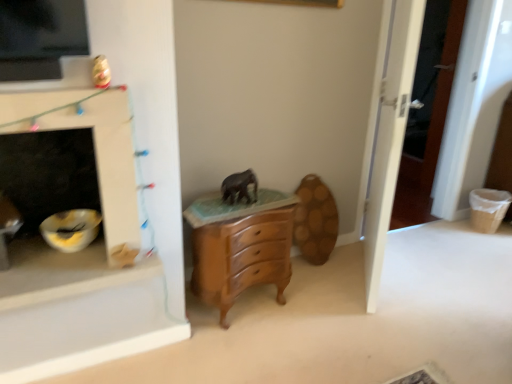
Measure the distance between white glossy fireplace at left and camera.

white glossy fireplace at left is 1.37 meters from camera.

Locate an element on the screen. wooden chest of drawers at center is located at coordinates (241, 247).

Considering the relative positions of white glossy fireplace at left and matte gray elephant at center in the image provided, is white glossy fireplace at left in front of matte gray elephant at center?

That is True.

Would you consider white glossy fireplace at left to be distant from matte gray elephant at center?

No.

Is white glossy fireplace at left not inside matte gray elephant at center?

white glossy fireplace at left lies outside matte gray elephant at center's area.

Is point (46, 130) farther from viewer compared to point (226, 288)?

No, it is in front of (226, 288).

Is white glossy fireplace at left shorter than wooden chest of drawers at center?

In fact, white glossy fireplace at left may be taller than wooden chest of drawers at center.

Looking at this image, considering the positions of objects white glossy fireplace at left and wooden chest of drawers at center in the image provided, who is in front, white glossy fireplace at left or wooden chest of drawers at center?

white glossy fireplace at left is more forward.

At what (x,y) coordinates should I click in order to perform the action: click on the chest of drawers behind the white wooden door at right. Please return your answer as a coordinate pair (x, y). The image size is (512, 384). Looking at the image, I should click on (241, 247).

From the picture: From a real-world perspective, which object rests below the other?

wooden chest of drawers at center is physically lower.

Which is behind, wooden chest of drawers at center or white wooden door at right?

wooden chest of drawers at center is further from the camera.

How distant is wooden chest of drawers at center from white wooden door at right?

The distance of wooden chest of drawers at center from white wooden door at right is 27.19 inches.

Is wooden chest of drawers at center positioned far away from white glossy fireplace at left?

No, wooden chest of drawers at center is in close proximity to white glossy fireplace at left.

Locate an element on the screen. fireplace above the wooden chest of drawers at center (from the image's perspective) is located at coordinates (69, 193).

From the image's perspective, is wooden chest of drawers at center on white glossy fireplace at left?

No, from the image's perspective, wooden chest of drawers at center is not over white glossy fireplace at left.

How much distance is there between wooden chest of drawers at center and white glossy fireplace at left?

wooden chest of drawers at center is 21.29 inches from white glossy fireplace at left.

Is wooden chest of drawers at center taller or shorter than matte gray elephant at center?

Clearly, wooden chest of drawers at center is taller compared to matte gray elephant at center.

Are wooden chest of drawers at center and matte gray elephant at center located far from each other?

Actually, wooden chest of drawers at center and matte gray elephant at center are a little close together.

Considering the points (193, 211) and (224, 183), which point is in front, point (193, 211) or point (224, 183)?

The point (193, 211) is in front.

From a real-world perspective, which is physically below, wooden chest of drawers at center or matte gray elephant at center?

From a 3D spatial view, wooden chest of drawers at center is below.

Would you say matte gray elephant at center contains wooden chest of drawers at center?

No, wooden chest of drawers at center is not a part of matte gray elephant at center.

Does point (251, 178) appear closer or farther from the camera than point (273, 206)?

Clearly, point (251, 178) is more distant from the camera than point (273, 206).

Considering the positions of objects matte gray elephant at center and wooden chest of drawers at center in the image provided, who is more to the left, matte gray elephant at center or wooden chest of drawers at center?

wooden chest of drawers at center is more to the left.

How many degrees apart are the facing directions of matte gray elephant at center and wooden chest of drawers at center?

There is a 0.257-degree angle between the facing directions of matte gray elephant at center and wooden chest of drawers at center.

Considering the relative sizes of white glossy fireplace at left and white wooden door at right in the image provided, is white glossy fireplace at left wider than white wooden door at right?

Incorrect, the width of white glossy fireplace at left does not surpass that of white wooden door at right.

Does white glossy fireplace at left turn towards white wooden door at right?

No, white glossy fireplace at left is not aimed at white wooden door at right.

Is white glossy fireplace at left completely or partially outside of white wooden door at right?

That's correct, white glossy fireplace at left is outside of white wooden door at right.

The image size is (512, 384). In order to click on fireplace located in front of the matte gray elephant at center in this screenshot , I will do `click(69, 193)`.

Locate an element on the screen. chest of drawers below the white glossy fireplace at left (from the image's perspective) is located at coordinates (241, 247).

Based on their spatial positions, is white glossy fireplace at left or matte gray elephant at center further from white wooden door at right?

white glossy fireplace at left lies further to white wooden door at right than the other object.

When comparing their distances from white glossy fireplace at left, does white wooden door at right or matte gray elephant at center seem closer?

matte gray elephant at center is closer to white glossy fireplace at left.

In the scene shown: Based on their spatial positions, is white wooden door at right or wooden chest of drawers at center further from matte gray elephant at center?

Based on the image, white wooden door at right appears to be further to matte gray elephant at center.

Estimate the real-world distances between objects in this image. Which object is closer to wooden chest of drawers at center, white glossy fireplace at left or white wooden door at right?

white glossy fireplace at left lies closer to wooden chest of drawers at center than the other object.

Estimate the real-world distances between objects in this image. Which object is further from matte gray elephant at center, wooden chest of drawers at center or white glossy fireplace at left?

The object further to matte gray elephant at center is white glossy fireplace at left.

Considering their positions, is wooden chest of drawers at center positioned further to white glossy fireplace at left than matte gray elephant at center?

Answer: matte gray elephant at center.

From the picture: Considering their positions, is white glossy fireplace at left positioned further to matte gray elephant at center than white wooden door at right?

Among the two, white wooden door at right is located further to matte gray elephant at center.

Based on their spatial positions, is matte gray elephant at center or white glossy fireplace at left further from white wooden door at right?

white glossy fireplace at left lies further to white wooden door at right than the other object.

This screenshot has width=512, height=384. Identify the location of animal between wooden chest of drawers at center and white wooden door at right in the horizontal direction. (240, 187).

You are a GUI agent. You are given a task and a screenshot of the screen. Output one action in this format:
    pyautogui.click(x=<x>, y=<y>)
    Task: Click on the animal between white glossy fireplace at left and white wooden door at right from left to right
    Image resolution: width=512 pixels, height=384 pixels.
    Given the screenshot: What is the action you would take?
    pyautogui.click(x=240, y=187)

Identify the location of the chest of drawers situated between white glossy fireplace at left and white wooden door at right from left to right. (241, 247).

The width and height of the screenshot is (512, 384). Find the location of `chest of drawers between white glossy fireplace at left and matte gray elephant at center in the front-back direction`. chest of drawers between white glossy fireplace at left and matte gray elephant at center in the front-back direction is located at coordinates (241, 247).